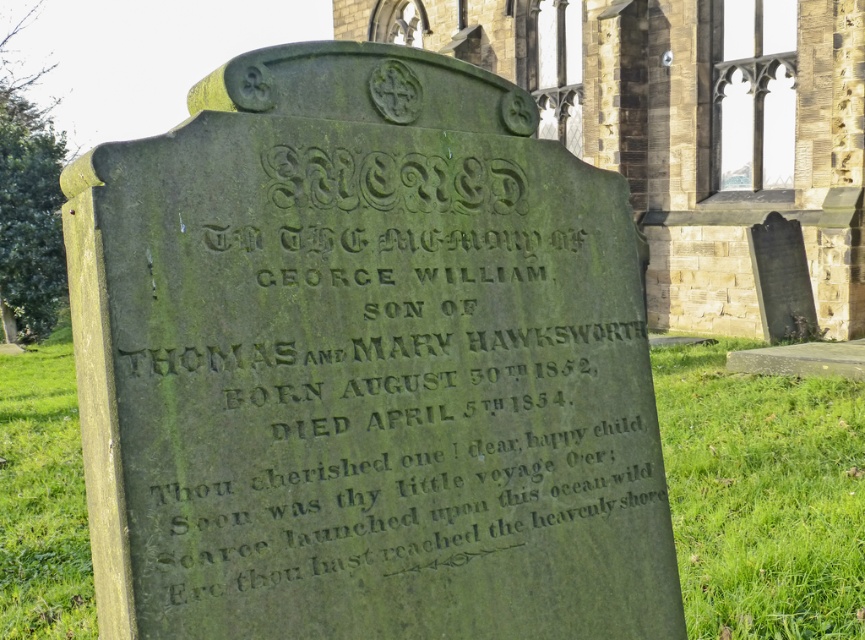
Who is shorter, green mossy stone monument at center or stone church at center?

Standing shorter between the two is green mossy stone monument at center.

Locate an element on the screen. green mossy stone monument at center is located at coordinates (364, 364).

The width and height of the screenshot is (865, 640). Describe the element at coordinates (364, 364) in the screenshot. I see `green mossy stone monument at center` at that location.

Locate an element on the screen. This screenshot has height=640, width=865. green mossy stone monument at center is located at coordinates (364, 364).

Is green mossy stone monument at center shorter than green mossy stone at center?

No.

Does green mossy stone monument at center appear on the right side of green mossy stone at center?

Indeed, green mossy stone monument at center is positioned on the right side of green mossy stone at center.

Is point (509, 294) closer to viewer compared to point (787, 486)?

Yes.

Where is `green mossy stone monument at center`? This screenshot has height=640, width=865. green mossy stone monument at center is located at coordinates (364, 364).

Is stone church at center wider than green mossy stone at center?

Yes, stone church at center is wider than green mossy stone at center.

Does stone church at center appear under green mossy stone at center?

Incorrect, stone church at center is not positioned below green mossy stone at center.

Identify the location of stone church at center. (686, 125).